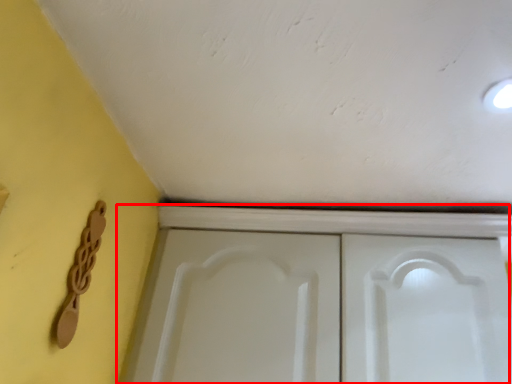
Question: Considering the relative positions of cupboard (annotated by the red box) and door handle in the image provided, where is cupboard (annotated by the red box) located with respect to the staircase?

Choices:
 (A) left
 (B) right

Answer: (B)